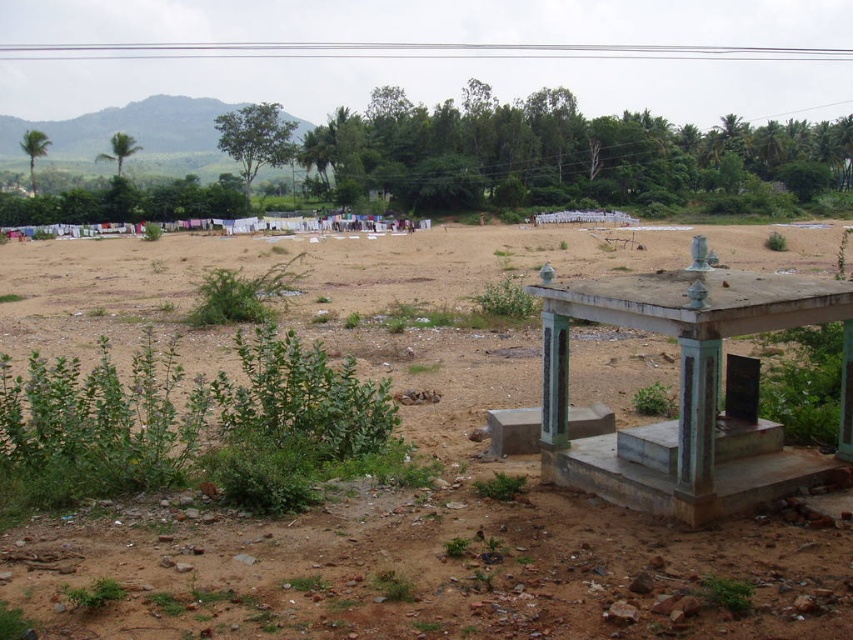
You are standing at the origin point of the coordinate system. Where is the brown dirt field at center located?

The brown dirt field at center is located at point (425, 541).

You are planning to set up a picnic area in the open space shown in the image. You have a picnic blanket that is 3 meters by 3 meters. Which location between the brown dirt field at center and the smooth concrete gazebo at center right would be more suitable for placing your picnic blanket, considering the size of the area?

The brown dirt field at center is larger in size than the smooth concrete gazebo at center right, so the picnic blanket would fit better on the brown dirt field at center.

You are standing at the edge of the open area looking towards the midground where the clothes are drying. There are two points marked in the image, point A at coordinates point (149,628) and point B at coordinates point (602,445). Which point is closer to you?

Point point (149,628) is closer to you than point point (602,445).